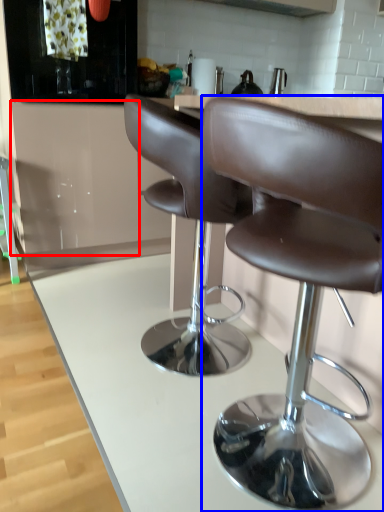
Question: Which object appears closest to the camera in this image, cabinetry (highlighted by a red box) or chair (highlighted by a blue box)?

Choices:
 (A) cabinetry
 (B) chair

Answer: (B)